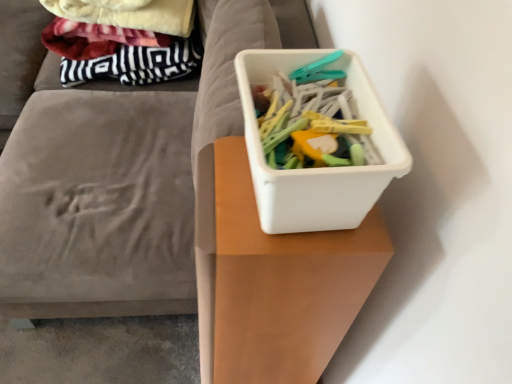
Question: Is white plastic container at upper right inside white plastic container at center?

Choices:
 (A) yes
 (B) no

Answer: (B)

Question: Is white plastic container at center smaller than white plastic container at upper right?

Choices:
 (A) yes
 (B) no

Answer: (B)

Question: Considering the relative sizes of white plastic container at center and white plastic container at upper right in the image provided, is white plastic container at center taller than white plastic container at upper right?

Choices:
 (A) no
 (B) yes

Answer: (A)

Question: Does white plastic container at center have a larger size compared to white plastic container at upper right?

Choices:
 (A) yes
 (B) no

Answer: (A)

Question: Is white plastic container at center positioned far away from white plastic container at upper right?

Choices:
 (A) yes
 (B) no

Answer: (B)

Question: Considering the positions of white plastic container at center and white plastic container at center in the image, is white plastic container at center wider or thinner than white plastic container at center?

Choices:
 (A) thin
 (B) wide

Answer: (B)

Question: Is white plastic container at center in front of or behind white plastic container at center in the image?

Choices:
 (A) front
 (B) behind

Answer: (B)

Question: In the image, is white plastic container at center on the left side or the right side of white plastic container at center?

Choices:
 (A) right
 (B) left

Answer: (B)

Question: Which is correct: white plastic container at center is inside white plastic container at center, or outside of it?

Choices:
 (A) inside
 (B) outside

Answer: (B)

Question: In terms of size, does white plastic container at center appear bigger or smaller than white plastic container at upper right?

Choices:
 (A) small
 (B) big

Answer: (B)

Question: From a real-world perspective, is white plastic container at center above or below white plastic container at upper right?

Choices:
 (A) below
 (B) above

Answer: (A)

Question: Is white plastic container at center taller or shorter than white plastic container at upper right?

Choices:
 (A) tall
 (B) short

Answer: (B)

Question: In the image, is white plastic container at center on the left side or the right side of white plastic container at upper right?

Choices:
 (A) right
 (B) left

Answer: (B)

Question: Is white plastic container at upper right inside the boundaries of white plastic container at center, or outside?

Choices:
 (A) inside
 (B) outside

Answer: (B)

Question: Is white plastic container at upper right bigger or smaller than white plastic container at center?

Choices:
 (A) small
 (B) big

Answer: (B)